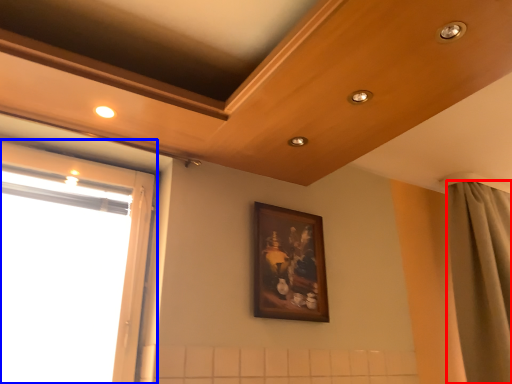
Question: Among these objects, which one is farthest to the camera, curtain (highlighted by a red box) or window (highlighted by a blue box)?

Choices:
 (A) curtain
 (B) window

Answer: (A)